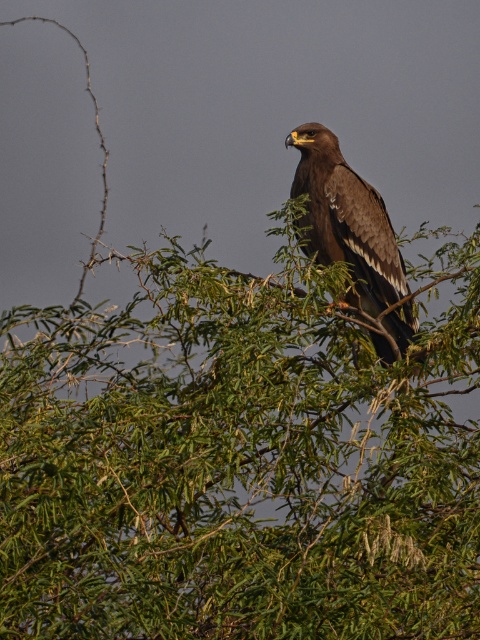
Question: From the image, what is the correct spatial relationship of green leafy tree at upper center in relation to brown feathered eagle at center?

Choices:
 (A) above
 (B) below

Answer: (B)

Question: Considering the relative positions of green leafy tree at upper center and brown feathered eagle at center in the image provided, where is green leafy tree at upper center located with respect to brown feathered eagle at center?

Choices:
 (A) above
 (B) below

Answer: (B)

Question: Which point appears farthest from the camera in this image?

Choices:
 (A) (389, 248)
 (B) (332, 397)

Answer: (A)

Question: Does green leafy tree at upper center appear over brown feathered eagle at center?

Choices:
 (A) no
 (B) yes

Answer: (A)

Question: Which of the following is the closest to the observer?

Choices:
 (A) (359, 289)
 (B) (164, 394)

Answer: (B)